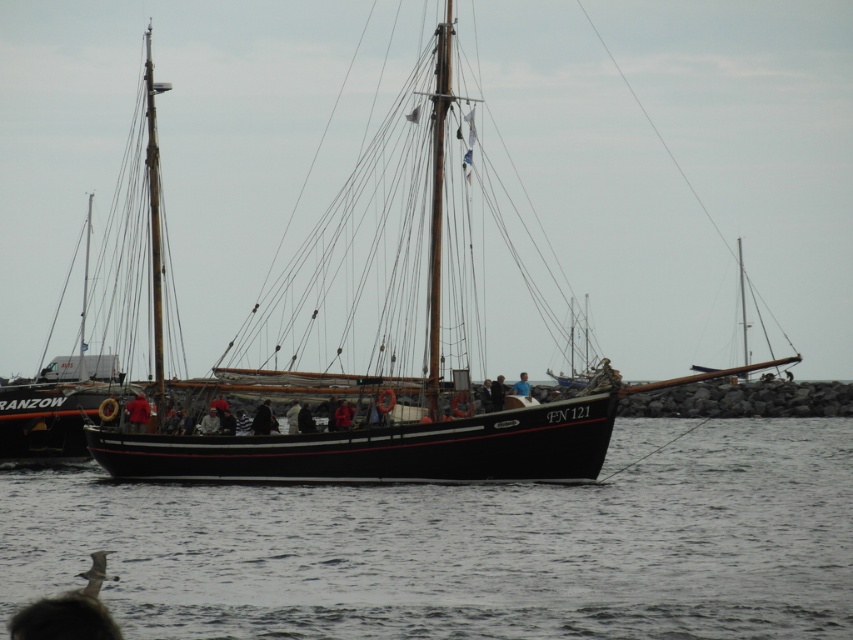
Question: Which point is closer to the camera?

Choices:
 (A) (743, 285)
 (B) (361, 464)

Answer: (B)

Question: Is rustic wood mast at center closer to camera compared to wooden mast at right?

Choices:
 (A) no
 (B) yes

Answer: (A)

Question: Which point is closer to the camera?

Choices:
 (A) black water at center
 (B) wooden mast at center

Answer: (A)

Question: Does dark blue fabric jacket at center have a lesser width compared to blue fabric at center?

Choices:
 (A) no
 (B) yes

Answer: (B)

Question: Can you confirm if black polished wood sailboat at center is bigger than dark blue fabric jacket at center?

Choices:
 (A) yes
 (B) no

Answer: (A)

Question: Estimate the real-world distances between objects in this image. Which object is farther from the blue fabric at center?

Choices:
 (A) smooth wood mast at center
 (B) black water at center
 (C) black polished wood sailboat at center
 (D) dark blue fabric jacket at center

Answer: (A)